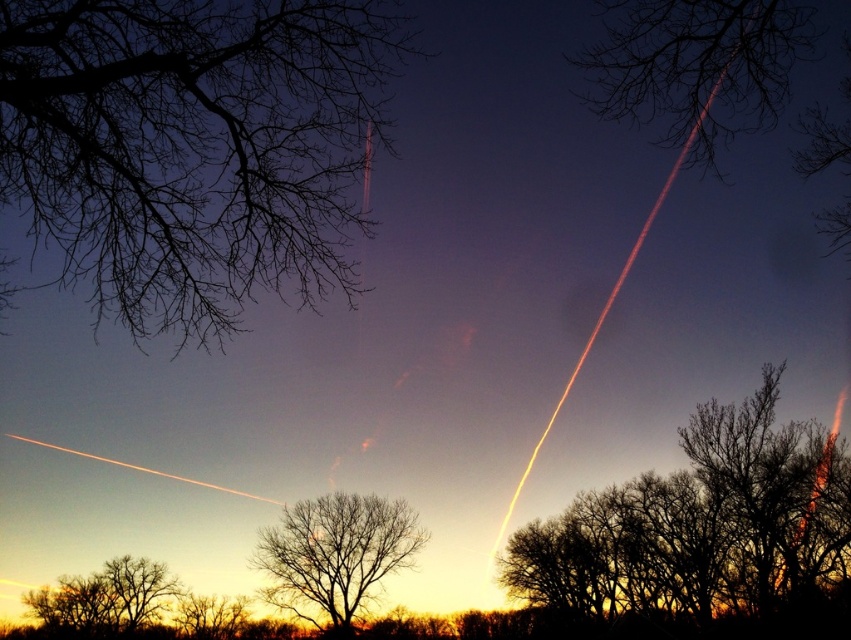
Can you confirm if silhouette bare branches at upper left is bigger than brown leafless tree at center?

Incorrect, silhouette bare branches at upper left is not larger than brown leafless tree at center.

Who is higher up, silhouette bare branches at upper left or brown leafless tree at center?

silhouette bare branches at upper left is above.

Is point (175, 56) less distant than point (700, 609)?

Yes, it is in front of point (700, 609).

The width and height of the screenshot is (851, 640). In order to click on silhouette bare branches at upper left in this screenshot , I will do `click(193, 147)`.

Does brown leafless tree at center come behind silhouette bare tree at upper right?

Yes, it is behind silhouette bare tree at upper right.

Which of these two, brown leafless tree at center or silhouette bare tree at upper right, stands shorter?

silhouette bare tree at upper right

Between point (703, 472) and point (801, 12), which one is positioned in front?

Point (801, 12) is in front.

You are a GUI agent. You are given a task and a screenshot of the screen. Output one action in this format:
    pyautogui.click(x=<x>, y=<y>)
    Task: Click on the brown leafless tree at center
    Image resolution: width=851 pixels, height=640 pixels.
    Given the screenshot: What is the action you would take?
    pyautogui.click(x=700, y=524)

Can you confirm if silhouette bare branches at upper left is bigger than bare branches at center?

No.

Which is below, silhouette bare branches at upper left or bare branches at center?

Positioned lower is bare branches at center.

You are a GUI agent. You are given a task and a screenshot of the screen. Output one action in this format:
    pyautogui.click(x=<x>, y=<y>)
    Task: Click on the silhouette bare branches at upper left
    
    Given the screenshot: What is the action you would take?
    pyautogui.click(x=193, y=147)

Locate an element on the screen. silhouette bare branches at upper left is located at coordinates (193, 147).